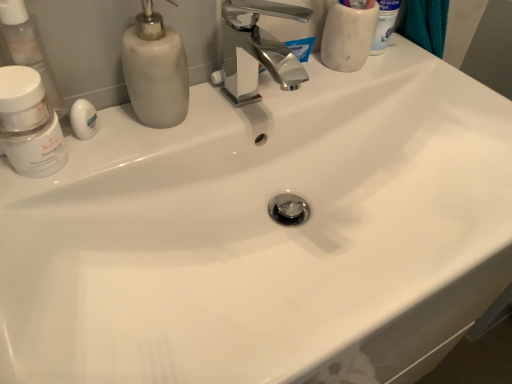
Image resolution: width=512 pixels, height=384 pixels. I want to click on white matte soap at left, so click(x=84, y=119).

Measure the distance between point (1, 70) and camera.

A distance of 17.32 inches exists between point (1, 70) and camera.

This screenshot has height=384, width=512. I want to click on white marble cup at upper right, which is the first toiletry in back-to-front order, so click(348, 37).

Describe the element at coordinates (28, 48) in the screenshot. Image resolution: width=512 pixels, height=384 pixels. I see `transparent plastic container at left, acting as the 1th toiletry starting from the left` at that location.

Locate an element on the screen. white matte soap at left is located at coordinates (84, 119).

At what (x,y) coordinates should I click in order to perform the action: click on soap in front of the white marble cup at upper right, which is the first toiletry in back-to-front order. Please return your answer as a coordinate pair (x, y). The height and width of the screenshot is (384, 512). Looking at the image, I should click on (84, 119).

In the scene shown: Which is more to the right, white matte soap at left or white marble cup at upper right, which is the first toiletry in back-to-front order?

Positioned to the right is white marble cup at upper right, which is the first toiletry in back-to-front order.

Is white matte soap at left placed right next to white marble cup at upper right, the 2th toiletry from the bottom?

white matte soap at left and white marble cup at upper right, the 2th toiletry from the bottom, are clearly separated.

From a real-world perspective, is white matte soap at left below white marble cup at upper right, which is the first toiletry in back-to-front order?

Yes, from a real-world perspective, white matte soap at left is under white marble cup at upper right, which is the first toiletry in back-to-front order.

Between transparent plastic container at left, the 2th toiletry viewed from the right, and white matte soap at left, which one has smaller size?

Smaller between the two is white matte soap at left.

Locate an element on the screen. soap on the right of transparent plastic container at left, the second toiletry viewed from the back is located at coordinates (84, 119).

Does point (52, 85) come farther from viewer compared to point (83, 110)?

Yes, it is behind point (83, 110).

From the image's perspective, which one is positioned higher, transparent plastic container at left, acting as the second toiletry starting from the top, or white matte soap at left?

From the image's view, transparent plastic container at left, acting as the second toiletry starting from the top, is above.

Could you tell me if white matte soap at left is facing white matte jar at left?

No, white matte soap at left is not facing towards white matte jar at left.

Which is correct: white matte soap at left is inside white matte jar at left, or outside of it?

white matte soap at left lies outside white matte jar at left.

From the image's perspective, is white matte soap at left above or below white matte jar at left?

From the image's perspective, white matte soap at left appears above white matte jar at left.

Which is more to the left, white matte soap at left or white matte jar at left?

white matte jar at left.

From their relative heights in the image, would you say white marble cup at upper right, the 2th toiletry from the bottom, is taller or shorter than matte white soap dispenser at upper left?

Considering their sizes, white marble cup at upper right, the 2th toiletry from the bottom, has more height than matte white soap dispenser at upper left.

Would you say white marble cup at upper right, the 1th toiletry positioned from the top, is to the left or to the right of matte white soap dispenser at upper left in the picture?

white marble cup at upper right, the 1th toiletry positioned from the top, is to the right of matte white soap dispenser at upper left.

Between point (347, 17) and point (154, 54), which one is positioned in front?

Positioned in front is point (154, 54).

Is transparent plastic container at left, the second toiletry viewed from the back, wider or thinner than white marble cup at upper right, the 2th toiletry from the bottom?

Considering their sizes, transparent plastic container at left, the second toiletry viewed from the back, looks slimmer than white marble cup at upper right, the 2th toiletry from the bottom.

Between transparent plastic container at left, the second toiletry viewed from the back, and white marble cup at upper right, acting as the 2th toiletry starting from the left, which one appears on the left side from the viewer's perspective?

transparent plastic container at left, the second toiletry viewed from the back.

From a real-world perspective, between transparent plastic container at left, acting as the second toiletry starting from the top, and white marble cup at upper right, the 1th toiletry positioned from the top, who is vertically lower?

transparent plastic container at left, acting as the second toiletry starting from the top, is physically lower.

Can you confirm if transparent plastic container at left, the second toiletry viewed from the back, is smaller than white marble cup at upper right, the 2th toiletry from the bottom?

Yes, transparent plastic container at left, the second toiletry viewed from the back, is smaller than white marble cup at upper right, the 2th toiletry from the bottom.

What's the angular difference between matte white soap dispenser at upper left and white matte jar at left's facing directions?

The angle between the facing direction of matte white soap dispenser at upper left and the facing direction of white matte jar at left is 0.000207 degrees.

Is matte white soap dispenser at upper left surrounding white matte jar at left?

That's incorrect, white matte jar at left is not inside matte white soap dispenser at upper left.

In the image, is matte white soap dispenser at upper left positioned in front of or behind white matte jar at left?

matte white soap dispenser at upper left is positioned farther from the viewer than white matte jar at left.

In the scene shown: Is matte white soap dispenser at upper left beside white matte jar at left?

No, matte white soap dispenser at upper left is not next to white matte jar at left.

Can transparent plastic container at left, acting as the second toiletry starting from the top, be found inside white marble cup at upper right, the 2th toiletry from the bottom?

No, transparent plastic container at left, acting as the second toiletry starting from the top, is not a part of white marble cup at upper right, the 2th toiletry from the bottom.

Who is smaller, white marble cup at upper right, placed as the 1th toiletry when sorted from right to left, or transparent plastic container at left, the second toiletry viewed from the back?

With smaller size is transparent plastic container at left, the second toiletry viewed from the back.

Between white marble cup at upper right, which is the 2th toiletry in front-to-back order, and transparent plastic container at left, the 2th toiletry viewed from the right, which one appears on the left side from the viewer's perspective?

transparent plastic container at left, the 2th toiletry viewed from the right.

Image resolution: width=512 pixels, height=384 pixels. I want to click on toiletry located behind the transparent plastic container at left, the 2th toiletry viewed from the right, so click(x=348, y=37).

I want to click on soap below the white marble cup at upper right, the 1th toiletry positioned from the top (from a real-world perspective), so click(84, 119).

At what (x,y) coordinates should I click in order to perform the action: click on toiletry lying on the left of white matte soap at left. Please return your answer as a coordinate pair (x, y). The image size is (512, 384). Looking at the image, I should click on (28, 48).

From the image, which object appears to be farther from transparent plastic container at left, which is the 1th toiletry from bottom to top, white matte soap at left or white marble cup at upper right, which is the first toiletry in back-to-front order?

white marble cup at upper right, which is the first toiletry in back-to-front order.

From the image, which object appears to be farther from white matte soap at left, white marble cup at upper right, placed as the 1th toiletry when sorted from right to left, or matte white soap dispenser at upper left?

white marble cup at upper right, placed as the 1th toiletry when sorted from right to left, is further to white matte soap at left.

Which object lies further to the anchor point matte white soap dispenser at upper left, transparent plastic container at left, the second toiletry viewed from the back, or white marble cup at upper right, the 2th toiletry from the bottom?

Among the two, white marble cup at upper right, the 2th toiletry from the bottom, is located further to matte white soap dispenser at upper left.

Considering their positions, is transparent plastic container at left, acting as the 1th toiletry starting from the left, positioned further to white matte jar at left than matte white soap dispenser at upper left?

Based on the image, matte white soap dispenser at upper left appears to be further to white matte jar at left.

When comparing their distances from matte white soap dispenser at upper left, does transparent plastic container at left, acting as the 1th toiletry starting from the left, or white matte soap at left seem closer?

white matte soap at left lies closer to matte white soap dispenser at upper left than the other object.

Estimate the real-world distances between objects in this image. Which object is closer to white marble cup at upper right, acting as the 2th toiletry starting from the left, matte white soap dispenser at upper left or white matte soap at left?

Among the two, matte white soap dispenser at upper left is located nearer to white marble cup at upper right, acting as the 2th toiletry starting from the left.

From the image, which object appears to be nearer to transparent plastic container at left, which is the 1th toiletry from bottom to top, white marble cup at upper right, the 2th toiletry from the bottom, or matte white soap dispenser at upper left?

matte white soap dispenser at upper left is closer to transparent plastic container at left, which is the 1th toiletry from bottom to top.

Which object lies nearer to the anchor point white marble cup at upper right, acting as the 2th toiletry starting from the left, white matte soap at left or white matte jar at left?

white matte soap at left lies closer to white marble cup at upper right, acting as the 2th toiletry starting from the left, than the other object.

Identify the location of soap dispenser between white matte jar at left and white marble cup at upper right, the 1th toiletry positioned from the top, in the horizontal direction. This screenshot has height=384, width=512. (155, 70).

Find the location of `soap dispenser between transparent plastic container at left, the first toiletry from the front, and white marble cup at upper right, acting as the 2th toiletry starting from the left`. soap dispenser between transparent plastic container at left, the first toiletry from the front, and white marble cup at upper right, acting as the 2th toiletry starting from the left is located at coordinates (155, 70).

Identify the location of soap between white matte jar at left and white marble cup at upper right, the 1th toiletry positioned from the top, in the horizontal direction. (84, 119).

The width and height of the screenshot is (512, 384). Find the location of `soap located between transparent plastic container at left, acting as the 1th toiletry starting from the left, and white marble cup at upper right, the 2th toiletry from the bottom, in the left-right direction`. soap located between transparent plastic container at left, acting as the 1th toiletry starting from the left, and white marble cup at upper right, the 2th toiletry from the bottom, in the left-right direction is located at coordinates (84, 119).